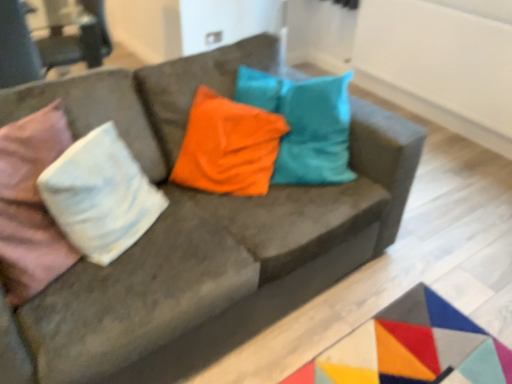
Question: Visually, is white cotton pillow at left positioned to the left or to the right of velvet pink armchair at upper left?

Choices:
 (A) left
 (B) right

Answer: (B)

Question: From a real-world perspective, relative to velvet pink armchair at upper left, is white cotton pillow at left vertically above or below?

Choices:
 (A) above
 (B) below

Answer: (A)

Question: Is white cotton pillow at left situated inside velvet pink armchair at upper left or outside?

Choices:
 (A) inside
 (B) outside

Answer: (B)

Question: In terms of width, does velvet pink armchair at upper left look wider or thinner when compared to white cotton pillow at left?

Choices:
 (A) thin
 (B) wide

Answer: (B)

Question: From a real-world perspective, relative to white cotton pillow at left, is velvet pink armchair at upper left vertically above or below?

Choices:
 (A) below
 (B) above

Answer: (A)

Question: From the image's perspective, is velvet pink armchair at upper left positioned above or below white cotton pillow at left?

Choices:
 (A) below
 (B) above

Answer: (B)

Question: Is velvet pink armchair at upper left in front of or behind white cotton pillow at left in the image?

Choices:
 (A) behind
 (B) front

Answer: (A)